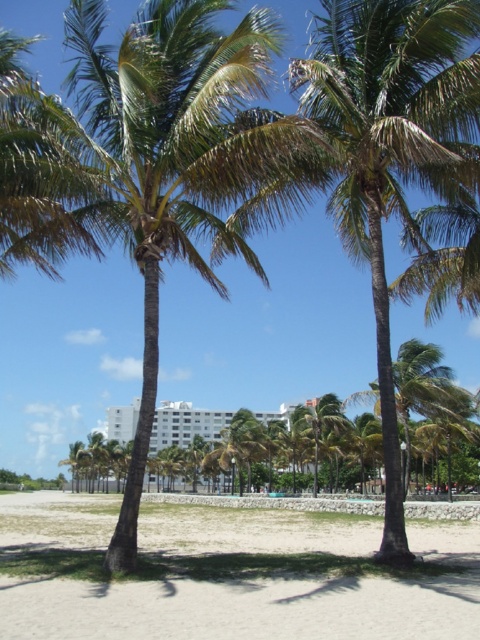
You are standing in the tropical scene and want to walk from the green leafy palm tree at center to the beige sandy beach at center. In which direction should you head to reach the beach?

The green leafy palm tree at center is to the left of the beige sandy beach at center, so you should head to the right to reach the beach.

You are standing in the tropical scene and want to take a photo of the white smooth building at center without the green leafy palm tree at center blocking it. How should you position yourself relative to the palm tree?

Move behind the green leafy palm tree at center so that the white smooth building at center is visible beyond it, since the palm tree is closer to you than the building.

You are standing at the point marked as point [144,376] and want to walk towards the point marked as point [201,550]. Given that the distance between these two points is 10 meters, and you can walk at a speed of 1.5 meters per second, how many seconds will it take you to reach the destination?

The distance between point [144,376] and point [201,550] is 10 meters. At a walking speed of 1.5 meters per second, it would take approximately 6.67 seconds to reach the destination.